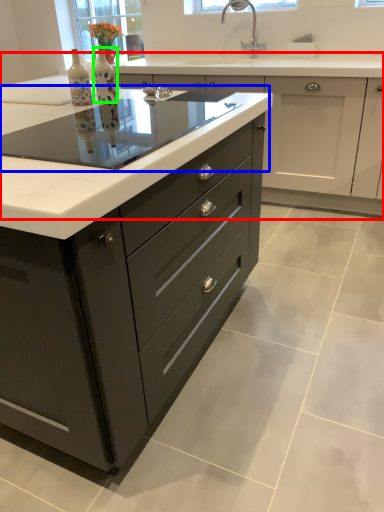
Question: Based on their relative distances, which object is farther from cabinetry (highlighted by a red box)? Choose from glass table (highlighted by a blue box) and bottle (highlighted by a green box).

Choices:
 (A) glass table
 (B) bottle

Answer: (B)